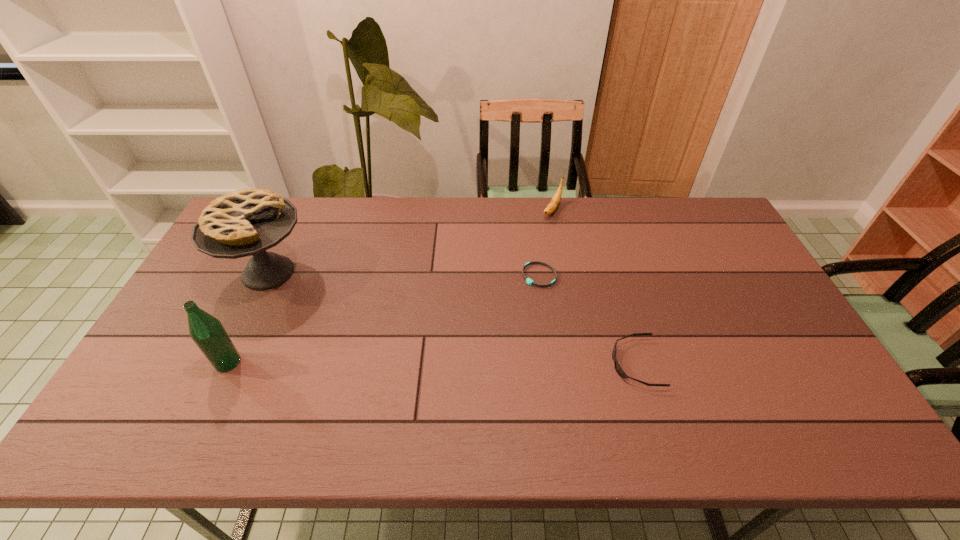
I want to click on free space between the pie and the second shortest object, so click(452, 318).

You are a GUI agent. You are given a task and a screenshot of the screen. Output one action in this format:
    pyautogui.click(x=<x>, y=<y>)
    Task: Click on the free point between the third shortest object and the sunglasses
    The image size is (960, 540).
    Given the screenshot: What is the action you would take?
    pyautogui.click(x=594, y=287)

Locate an element on the screen. vacant space that's between the farthest object and the bottle is located at coordinates (390, 286).

You are a GUI agent. You are given a task and a screenshot of the screen. Output one action in this format:
    pyautogui.click(x=<x>, y=<y>)
    Task: Click on the vacant point located between the shortest object and the bottle
    
    Given the screenshot: What is the action you would take?
    pyautogui.click(x=383, y=319)

Locate an element on the screen. The width and height of the screenshot is (960, 540). free space that is in between the third shortest object and the bottle is located at coordinates (390, 286).

Find the location of a particular element. This screenshot has width=960, height=540. free space between the third shortest object and the bottle is located at coordinates (390, 286).

You are a GUI agent. You are given a task and a screenshot of the screen. Output one action in this format:
    pyautogui.click(x=<x>, y=<y>)
    Task: Click on the free space between the sunglasses and the farthest object
    
    Given the screenshot: What is the action you would take?
    pyautogui.click(x=594, y=287)

Where is `object that stands as the fourth closest to the sunglasses`? The image size is (960, 540). object that stands as the fourth closest to the sunglasses is located at coordinates (207, 332).

Identify the location of object identified as the closest to the sunglasses. The image size is (960, 540). (530, 282).

The width and height of the screenshot is (960, 540). Find the location of `vacant region that satisfies the following two spatial constraints: 1. on the front side of the wristband; 2. on the left side of the pie`. vacant region that satisfies the following two spatial constraints: 1. on the front side of the wristband; 2. on the left side of the pie is located at coordinates (267, 275).